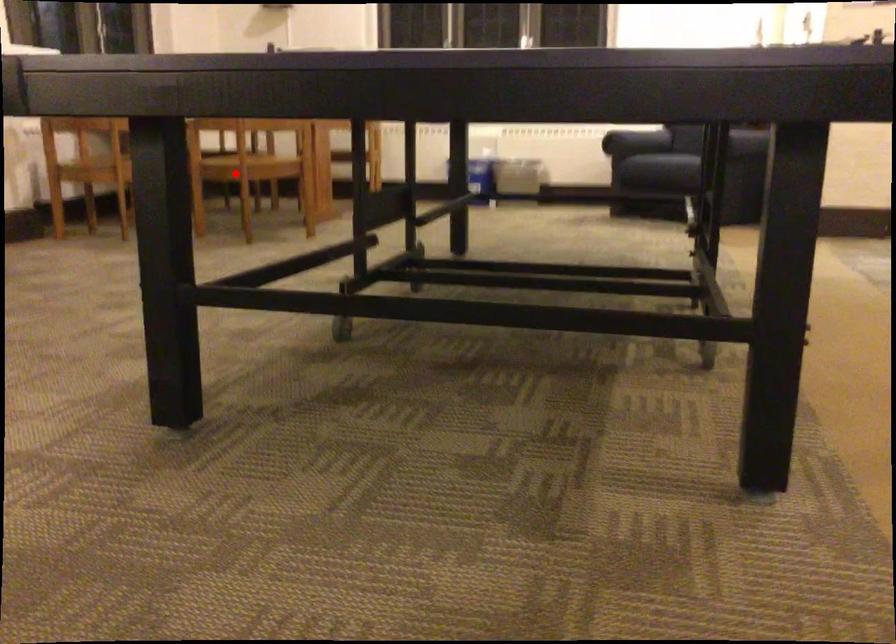
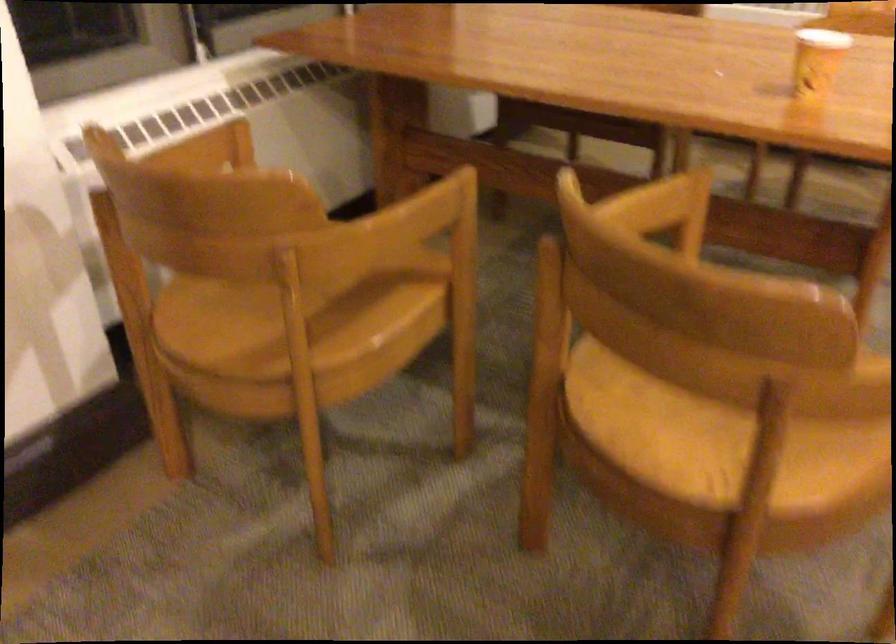
Locate, in the second image, the point that corresponds to the highlighted location in the first image.

(704, 433)